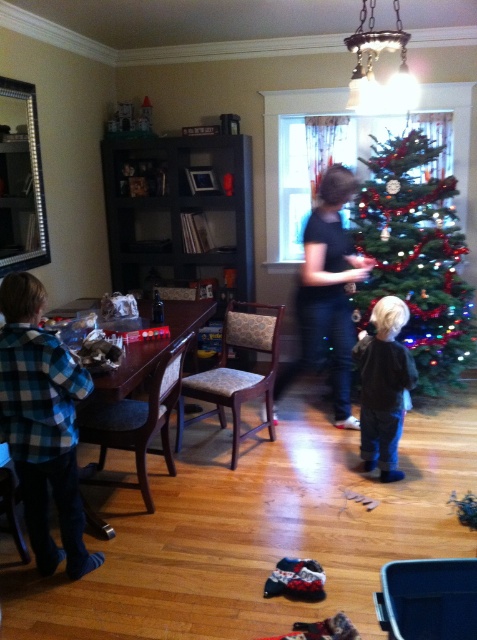
Question: Which of the following is the farthest from the observer?

Choices:
 (A) (391, 241)
 (B) (304, 308)
 (C) (371, 376)

Answer: (A)

Question: Is green shiny christmas tree at right positioned behind black velvet jacket at center?

Choices:
 (A) yes
 (B) no

Answer: (A)

Question: Is green shiny christmas tree at right behind black velvet jacket at center?

Choices:
 (A) yes
 (B) no

Answer: (A)

Question: Does green shiny christmas tree at right appear on the left side of black velvet jacket at center?

Choices:
 (A) yes
 (B) no

Answer: (B)

Question: Considering the real-world distances, which object is closest to the green shiny christmas tree at right?

Choices:
 (A) black matte shirt at center
 (B) black velvet jacket at center

Answer: (A)

Question: Which object appears farthest from the camera in this image?

Choices:
 (A) black velvet jacket at center
 (B) green shiny christmas tree at right
 (C) black matte shirt at center

Answer: (B)